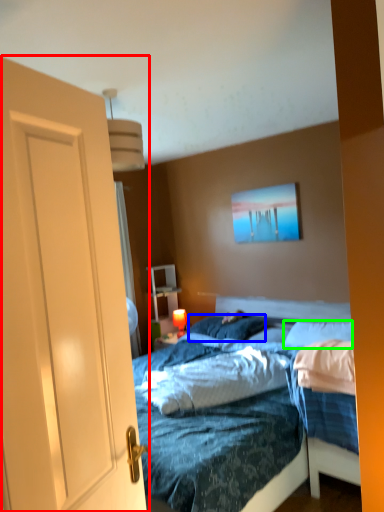
Question: Which is nearer to the door (highlighted by a red box)? pillow (highlighted by a blue box) or pillow (highlighted by a green box).

Choices:
 (A) pillow
 (B) pillow

Answer: (B)